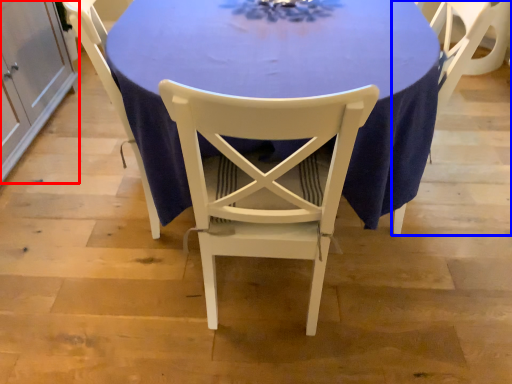
Question: Which object appears farthest to the camera in this image, cabinetry (highlighted by a red box) or chair (highlighted by a blue box)?

Choices:
 (A) cabinetry
 (B) chair

Answer: (A)